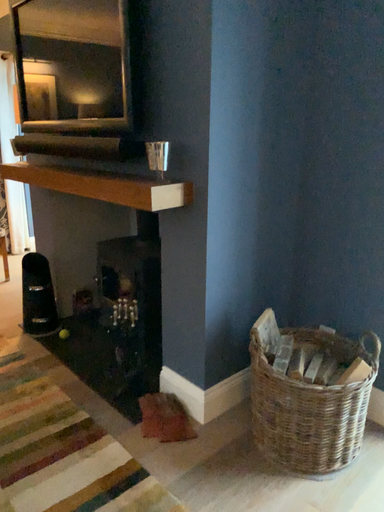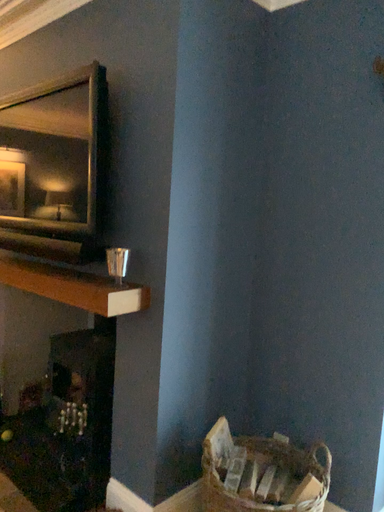
Question: Which way did the camera rotate in the video?

Choices:
 (A) rotated upward
 (B) rotated downward

Answer: (A)